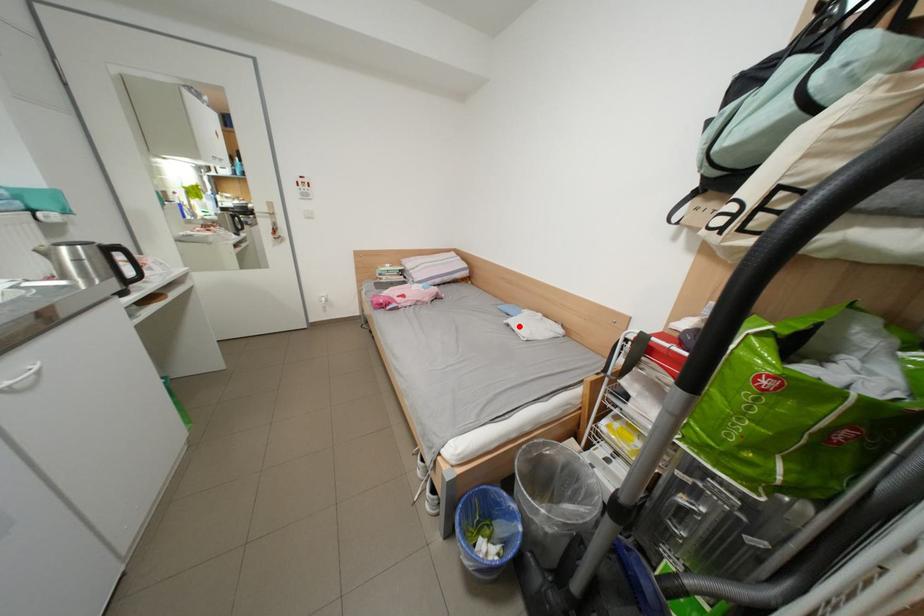
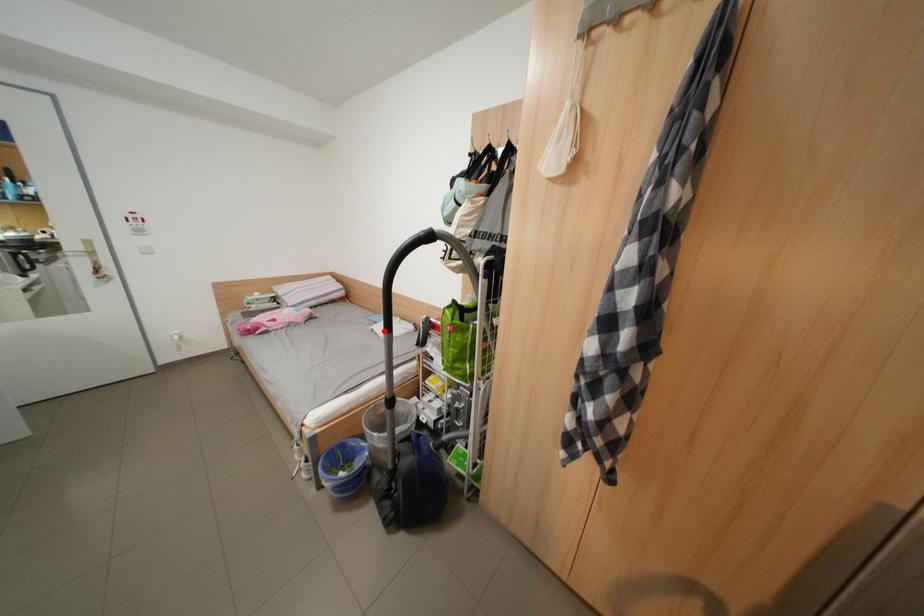
I am providing you with two images of the same scene from different viewpoints. A red point is marked on the first image and another point is marked on the second image. Is the red point in image1 aligned with the point shown in image2?

Yes